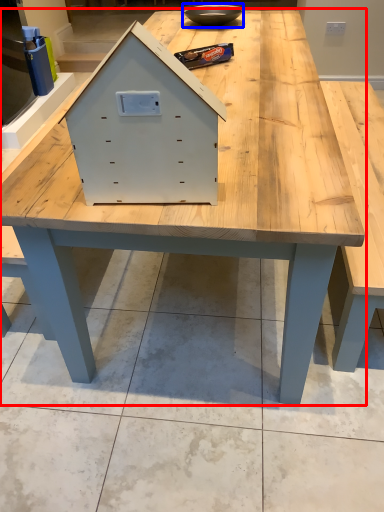
Question: Which point is further to the camera, table (highlighted by a red box) or bowl (highlighted by a blue box)?

Choices:
 (A) table
 (B) bowl

Answer: (B)